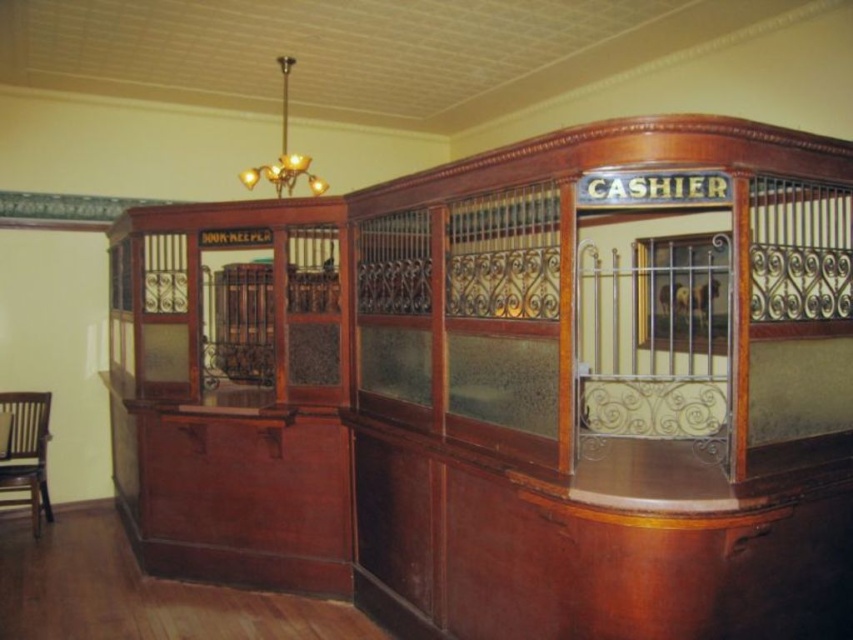
Question: Can you confirm if wooden chair at lower left is positioned above gold metallic chandelier at upper center?

Choices:
 (A) yes
 (B) no

Answer: (B)

Question: Is wooden chair at lower left to the left of gold metallic chandelier at upper center from the viewer's perspective?

Choices:
 (A) yes
 (B) no

Answer: (A)

Question: Can you confirm if wooden chair at lower left is smaller than gold metallic chandelier at upper center?

Choices:
 (A) no
 (B) yes

Answer: (B)